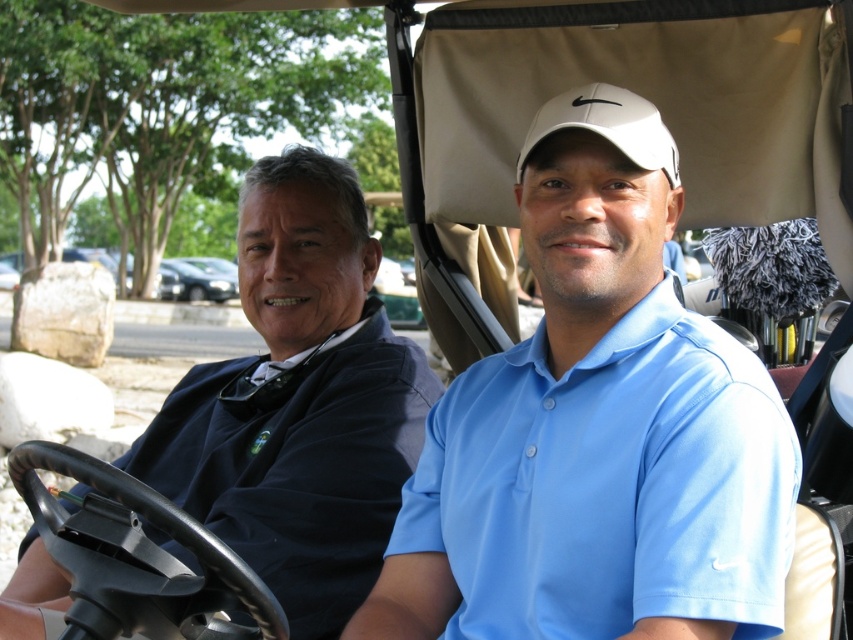
Question: Which point is farther to the camera?

Choices:
 (A) dark blue shirt at left
 (B) white matte baseball cap at center

Answer: (A)

Question: Does blue matte shirt at center appear on the right side of dark blue shirt at left?

Choices:
 (A) no
 (B) yes

Answer: (B)

Question: Can you confirm if blue matte shirt at center is positioned to the left of white matte baseball cap at center?

Choices:
 (A) yes
 (B) no

Answer: (A)

Question: Which point is closer to the camera taking this photo?

Choices:
 (A) (219, 458)
 (B) (544, 108)
 (C) (602, 237)

Answer: (C)

Question: Which of these objects is positioned closest to the blue matte shirt at center?

Choices:
 (A) white matte baseball cap at center
 (B) dark blue shirt at left

Answer: (A)

Question: Does dark blue shirt at left appear over white matte baseball cap at center?

Choices:
 (A) no
 (B) yes

Answer: (A)